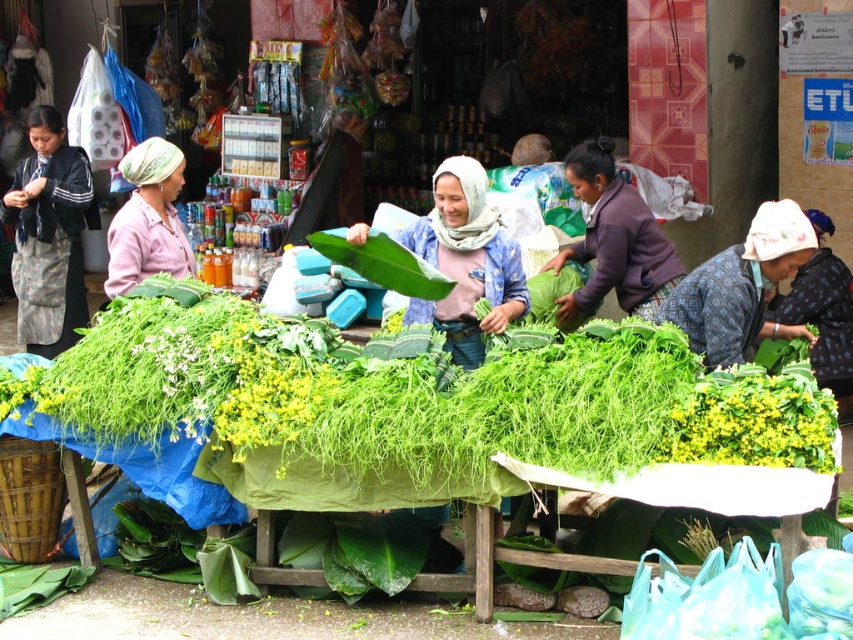
Based on the photo, you are a customer at the market and want to buy a fabric. You see the dark gray fabric at left and the purple fabric at center. Which fabric is covering the other one?

The dark gray fabric at left is positioned over the purple fabric at center, so the dark gray fabric at left is covering the purple fabric at center.

You are a customer at the market and want to buy the green leafy vegetables at center. The vendor is standing at the point with coordinates point (413, 397). Can you walk directly to the vegetables without passing through any other objects?

The point (413, 397) is on the green leafy vegetables at center, so you can walk directly to the vegetables without passing through any other objects.

You are a photographer standing at the camera position. You want to capture a closeup shot of the dark gray fabric at left without moving the camera. Is it possible to zoom in enough to get a clear closeup?

The dark gray fabric at left is 7.17 meters away from camera. Since the photographer cannot move the camera, they would need a zoom lens capable of focusing at that distance for a clear closeup.